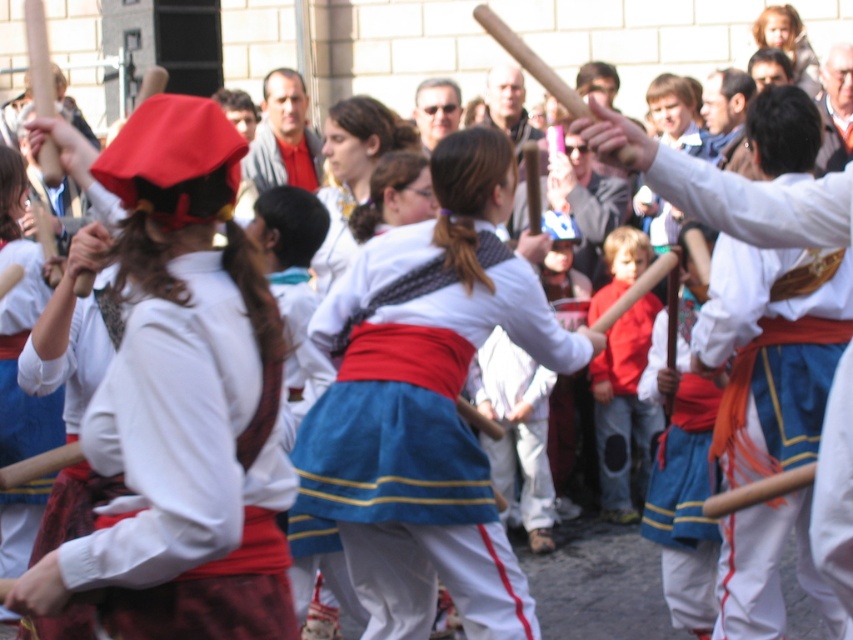
Question: Where is blue cotton skirt at center located in relation to blue satin sash at center in the image?

Choices:
 (A) above
 (B) below

Answer: (B)

Question: From the image, what is the correct spatial relationship of matte white blouse at center in relation to red cotton shirt at center?

Choices:
 (A) left
 (B) right

Answer: (A)

Question: Which point appears farthest from the camera in this image?

Choices:
 (A) (109, 369)
 (B) (631, 360)

Answer: (B)

Question: Considering the real-world distances, which object is farthest from the blue cotton skirt at center?

Choices:
 (A) blue satin sash at center
 (B) matte white blouse at center

Answer: (B)

Question: Considering the real-world distances, which object is closest to the blue satin sash at center?

Choices:
 (A) matte white blouse at center
 (B) blue cotton skirt at center

Answer: (B)

Question: Is blue satin sash at center closer to camera compared to red cotton shirt at center?

Choices:
 (A) no
 (B) yes

Answer: (B)